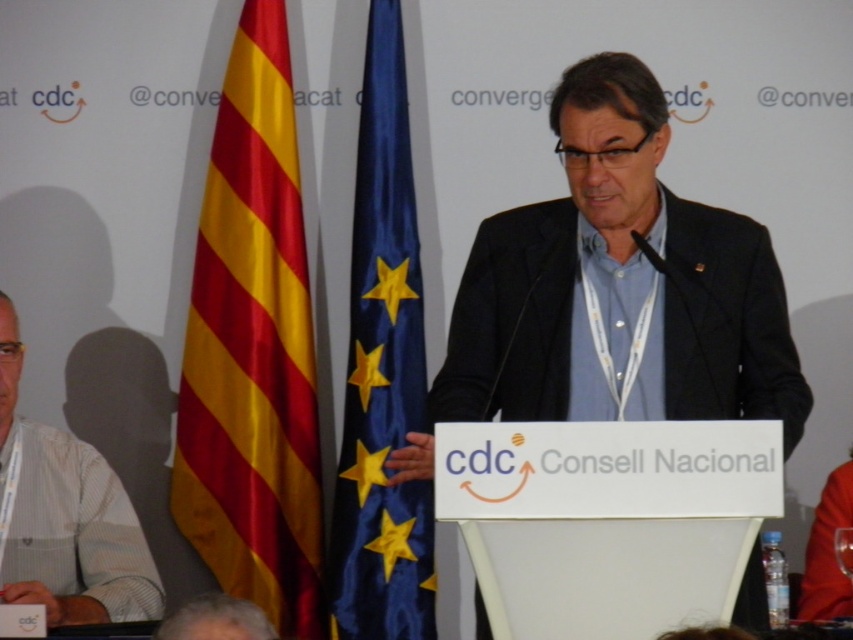
You are an event organizer and need to place a name tag on the podium for the speaker wearing the black matte suit at center. According to the coordinates provided, where should you place the name tag relative to the suit?

The black matte suit at center is located at point [619,285], so the name tag should be placed at that coordinate to ensure it is directly in front of the speaker.